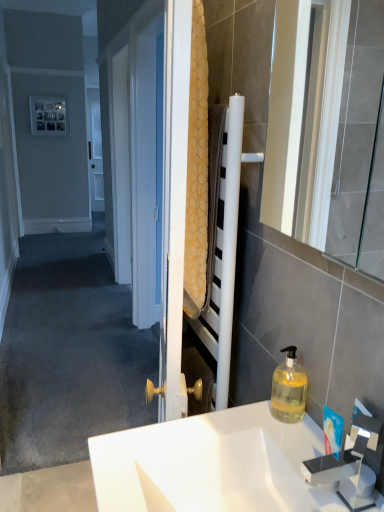
Question: Is white glossy sink at center smaller than white glossy mirror at right?

Choices:
 (A) no
 (B) yes

Answer: (A)

Question: From the image's perspective, is white glossy sink at center below white glossy mirror at right?

Choices:
 (A) yes
 (B) no

Answer: (A)

Question: Could you tell me if white glossy sink at center is facing white glossy mirror at right?

Choices:
 (A) no
 (B) yes

Answer: (A)

Question: From the image's perspective, is white glossy sink at center over white glossy mirror at right?

Choices:
 (A) no
 (B) yes

Answer: (A)

Question: Can you confirm if white glossy sink at center is taller than white glossy mirror at right?

Choices:
 (A) no
 (B) yes

Answer: (A)

Question: Considering the positions of metallic silver picture frame at upper left and white glossy sink at center in the image, is metallic silver picture frame at upper left bigger or smaller than white glossy sink at center?

Choices:
 (A) small
 (B) big

Answer: (A)

Question: From their relative heights in the image, would you say metallic silver picture frame at upper left is taller or shorter than white glossy sink at center?

Choices:
 (A) short
 (B) tall

Answer: (B)

Question: From a real-world perspective, is metallic silver picture frame at upper left physically located above or below white glossy sink at center?

Choices:
 (A) above
 (B) below

Answer: (A)

Question: Is metallic silver picture frame at upper left in front of or behind white glossy sink at center in the image?

Choices:
 (A) front
 (B) behind

Answer: (B)

Question: Is translucent plastic faucet at upper right situated inside white glossy sink at center or outside?

Choices:
 (A) outside
 (B) inside

Answer: (A)

Question: Does point (372, 492) appear closer or farther from the camera than point (264, 435)?

Choices:
 (A) farther
 (B) closer

Answer: (B)

Question: From a real-world perspective, relative to white glossy sink at center, is translucent plastic faucet at upper right vertically above or below?

Choices:
 (A) below
 (B) above

Answer: (B)

Question: In the image, is translucent plastic faucet at upper right positioned in front of or behind white glossy sink at center?

Choices:
 (A) front
 (B) behind

Answer: (B)

Question: From a real-world perspective, relative to translucent plastic faucet at upper right, is metallic silver picture frame at upper left vertically above or below?

Choices:
 (A) above
 (B) below

Answer: (A)

Question: Is metallic silver picture frame at upper left in front of or behind translucent plastic faucet at upper right in the image?

Choices:
 (A) behind
 (B) front

Answer: (A)